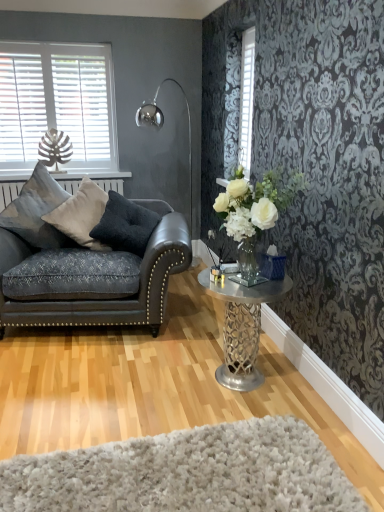
What are the coordinates of `vacant point above white shaggy rug at lower center (from a real-world perspective)` in the screenshot? It's located at (177, 470).